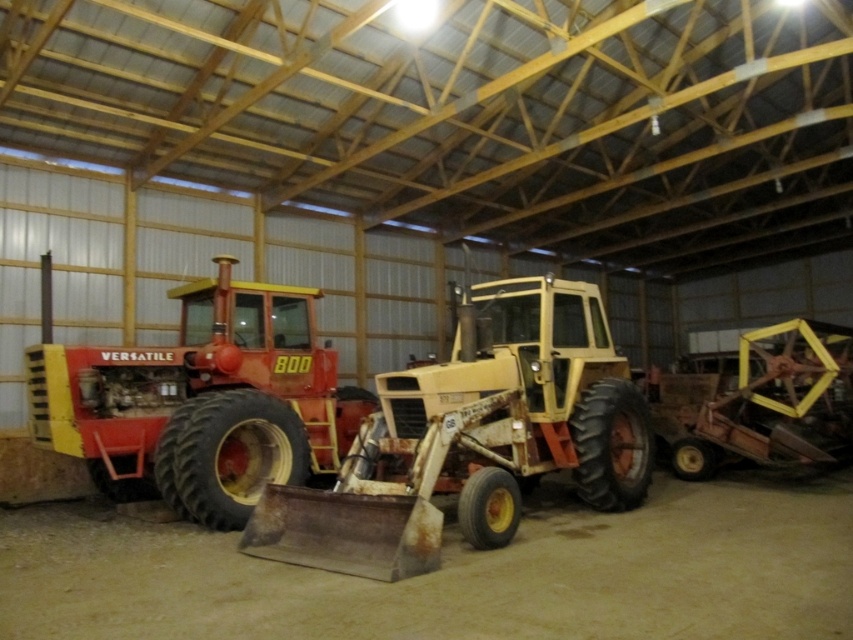
Does point (395, 513) lie behind point (267, 320)?

No.

Is rusty metal tractor at center taller than matte red tractor at left?

No, rusty metal tractor at center is not taller than matte red tractor at left.

Who is more forward, (374, 474) or (97, 380)?

Point (374, 474)

Find the location of `rusty metal tractor at center`. rusty metal tractor at center is located at coordinates (473, 436).